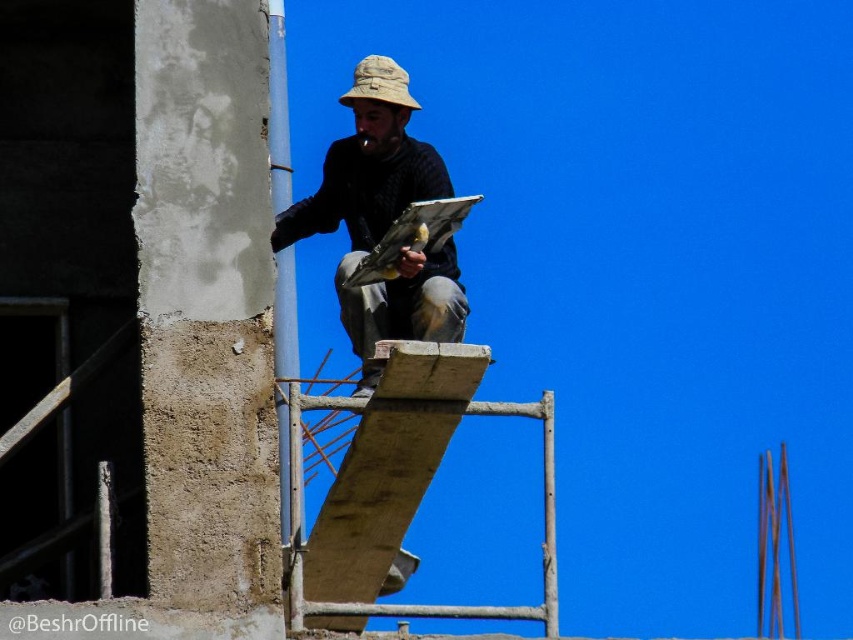
You are a safety inspector checking the construction site. You notice the matte black shirt at center and the tan fabric hat at center. According to safety regulations, the hat must be larger than the shirt to provide adequate coverage. Is the current setup compliant?

The matte black shirt at center is bigger than tan fabric hat at center, which violates the safety regulation requiring the hat to be larger than the shirt for proper coverage. The setup is not compliant.

You are a safety inspector evaluating the construction site. You notice the matte black shirt at center and the tan fabric hat at center. According to safety regulations, all workers must wear hats that are at least as tall as their shirts to ensure proper head protection. Does the worker comply with this regulation?

The matte black shirt at center is much taller than the tan fabric hat at center, so the worker does not comply with the regulation because the hat is shorter than the shirt.

What are the coordinates of the matte black shirt at center in the image?

The coordinates of the matte black shirt at center are at point (381,220).